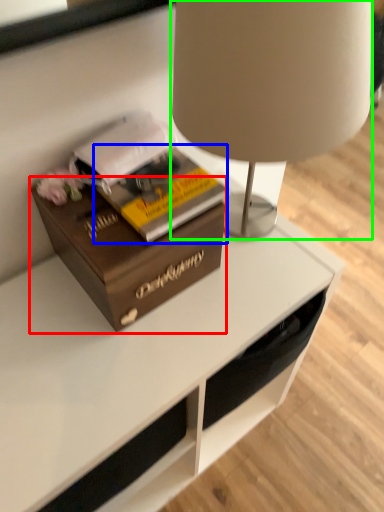
Question: Based on their relative distances, which object is nearer to box (highlighted by a red box)? Choose from paperback book (highlighted by a blue box) and lamp (highlighted by a green box).

Choices:
 (A) paperback book
 (B) lamp

Answer: (A)